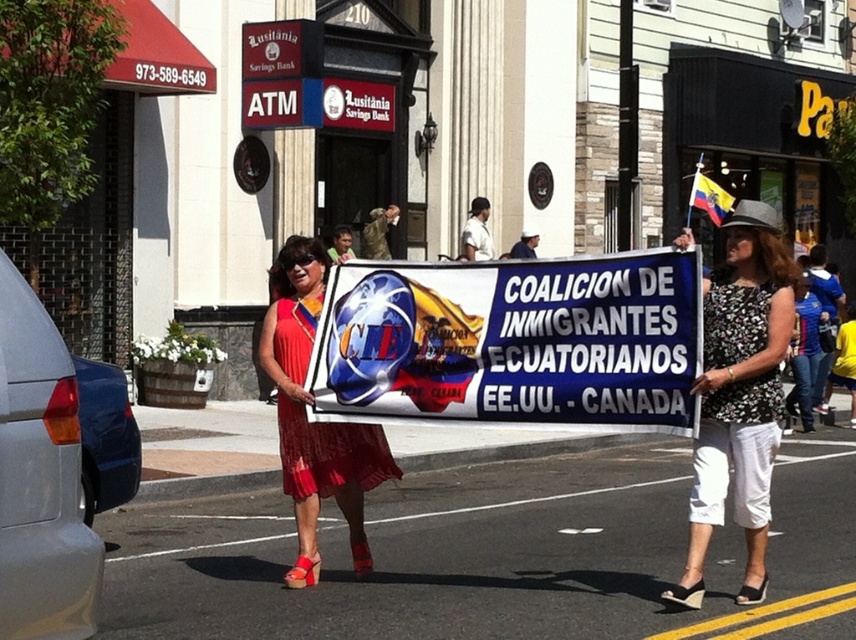
Question: Does white fabric banner at center appear on the right side of white cotton shirt at upper center?

Choices:
 (A) no
 (B) yes

Answer: (A)

Question: Can you confirm if white fabric banner at center is smaller than red chiffon dress at center?

Choices:
 (A) no
 (B) yes

Answer: (A)

Question: Which object is the farthest from the white cotton shirt at upper center?

Choices:
 (A) printed fabric dress at center
 (B) white fabric banner at center

Answer: (A)

Question: Which is farther from the white uniform at center?

Choices:
 (A) white cotton shirt at upper center
 (B) printed fabric dress at center
 (C) white fabric banner at center

Answer: (B)

Question: Is white fabric banner at center to the left of yellow and blue fabric flag at upper right from the viewer's perspective?

Choices:
 (A) yes
 (B) no

Answer: (A)

Question: Which object is farther from the camera taking this photo?

Choices:
 (A) white fabric banner at center
 (B) white cotton shirt at upper center
 (C) white uniform at center

Answer: (C)